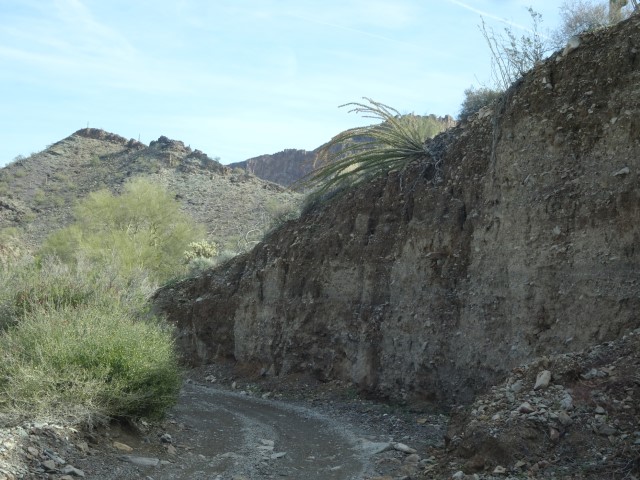
Where is `wall on right side`? This screenshot has width=640, height=480. wall on right side is located at coordinates (202, 320), (262, 321), (392, 312), (523, 309), (633, 305).